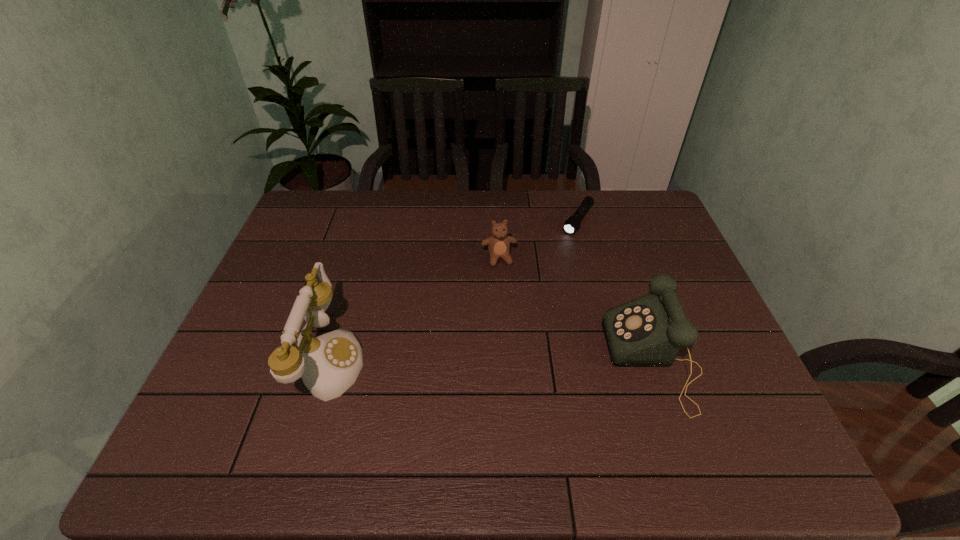
You are a GUI agent. You are given a task and a screenshot of the screen. Output one action in this format:
    pyautogui.click(x=<x>, y=<y>)
    Task: Click on the object at the right edge
    
    Given the screenshot: What is the action you would take?
    pyautogui.click(x=646, y=332)

At what (x,y) coordinates should I click in order to perform the action: click on object at the near left corner. Please return your answer as a coordinate pair (x, y). The image size is (960, 540). Looking at the image, I should click on (329, 364).

Locate an element on the screen. This screenshot has width=960, height=540. object that is at the near right corner is located at coordinates (646, 332).

Where is `free space at the far edge of the desktop`? The image size is (960, 540). free space at the far edge of the desktop is located at coordinates (502, 219).

Find the location of a particular element. vacant area at the near edge of the desktop is located at coordinates (467, 406).

This screenshot has height=540, width=960. I want to click on free space at the left edge, so click(282, 256).

Where is `free location at the far right corner of the desktop`? free location at the far right corner of the desktop is located at coordinates (652, 193).

The image size is (960, 540). Find the location of `vacant space at the near right corner of the desktop`. vacant space at the near right corner of the desktop is located at coordinates (695, 415).

This screenshot has height=540, width=960. In order to click on free space that is in between the right telephone and the third tallest object in this screenshot , I will do `click(576, 309)`.

Find the location of a particular element. This screenshot has width=960, height=540. vacant area that lies between the third object from right to left and the shorter telephone is located at coordinates (576, 309).